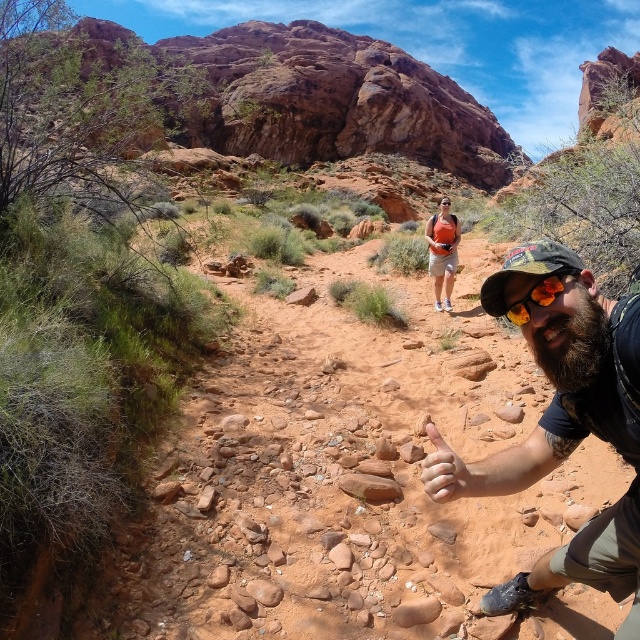
Based on the photo, you are a photographer wanting to capture both the bearded man at center and the orange reflective goggles at center in a single frame. Since the goggles are smaller, where should you position them relative to the man to ensure they are fully visible in the photo?

The orange reflective goggles at center are smaller than the bearded man at center, so positioning them closer to the camera than the man would help ensure they appear large enough in the photo to be fully visible.

You are a hiker who has just arrived at the desert trail. You see an orange backpack at center and an orange reflective goggles at center. Which object is closer to you?

The orange reflective goggles at center are closer to you because the orange backpack at center is positioned over it, indicating it is farther away.

You are a hiker planning to take a photo of the bearded man at center and the orange backpack at center. Since you want to include both in the frame, which object should you focus on first to ensure both are in focus?

The bearded man at center is positioned under orange backpack at center, so you should focus on the orange backpack at center first as it is farther away to ensure both are in focus.